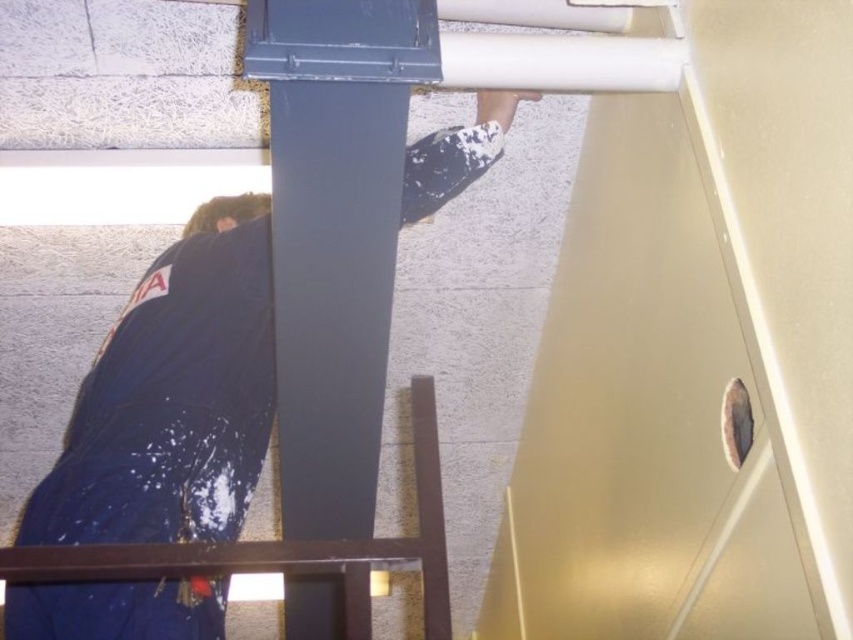
You are an interior designer assessing a room. You see the dark blue fabric at center and the matte gray column at center. Which object takes up more space in the room?

The matte gray column at center takes up more space than the dark blue fabric at center because the dark blue fabric at center occupies less space than matte gray column at center.